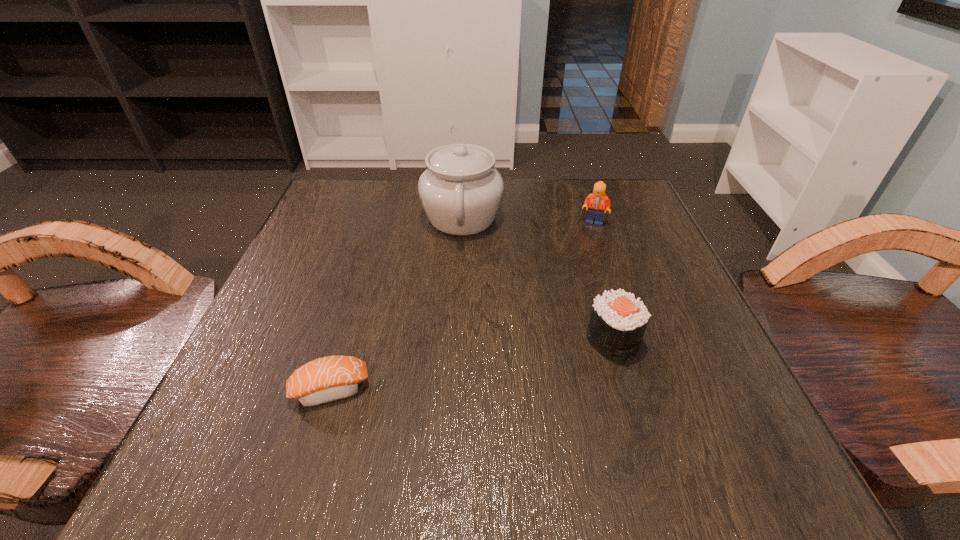
Image resolution: width=960 pixels, height=540 pixels. Identify the location of vacant area that lies between the Lego and the third tallest object. (603, 281).

Image resolution: width=960 pixels, height=540 pixels. What are the coordinates of `free space between the third shortest object and the right sushi` in the screenshot? It's located at (603, 281).

Identify the location of vacant space that's between the second tallest object and the nearer sushi. Image resolution: width=960 pixels, height=540 pixels. (462, 306).

The image size is (960, 540). Find the location of `free spot between the left sushi and the chinaware`. free spot between the left sushi and the chinaware is located at coordinates (396, 303).

In order to click on object that is the third closest one to the second nearest object in this screenshot , I will do `click(331, 378)`.

Locate an element on the screen. The image size is (960, 540). object that is the third closest to the Lego is located at coordinates (331, 378).

Image resolution: width=960 pixels, height=540 pixels. I want to click on free region that satisfies the following two spatial constraints: 1. on the back side of the nearest object; 2. on the right side of the third tallest object, so click(345, 340).